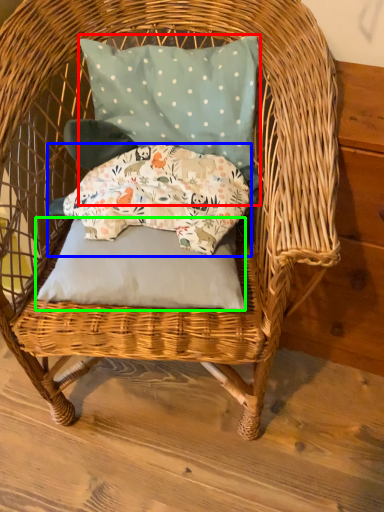
Question: Which object is positioned closest to pillow (highlighted by a red box)? Select from pillow (highlighted by a blue box) and pillow (highlighted by a green box).

Choices:
 (A) pillow
 (B) pillow

Answer: (A)